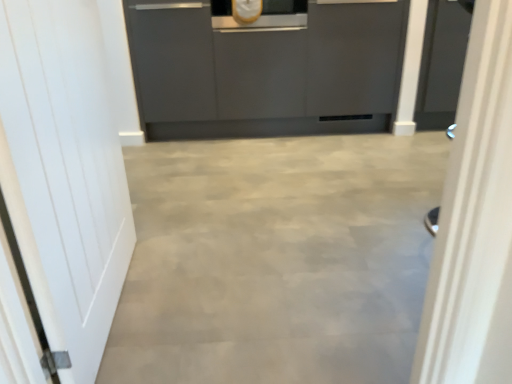
Question: Visually, is matte gray cabinetry at center positioned to the left or to the right of white glossy door at right, which ranks as the second door in left-to-right order?

Choices:
 (A) right
 (B) left

Answer: (B)

Question: Is matte gray cabinetry at center wider or thinner than white glossy door at right, which ranks as the second door in left-to-right order?

Choices:
 (A) thin
 (B) wide

Answer: (B)

Question: Which of these objects is positioned farthest from the matte gray cabinetry at center?

Choices:
 (A) white matte door at left, the 2th door when ordered from right to left
 (B) white glossy door at right, which ranks as the second door in left-to-right order

Answer: (B)

Question: Based on their relative distances, which object is farther from the white matte door at left, the first door when ordered from left to right?

Choices:
 (A) matte gray cabinetry at center
 (B) white glossy door at right, which ranks as the second door in left-to-right order

Answer: (A)